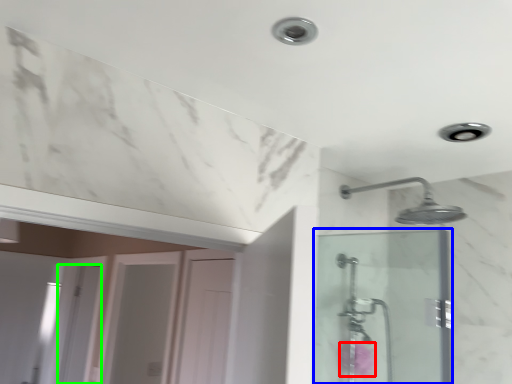
Question: Which object is positioned farthest from flower (highlighted by a red box)? Select from screen door (highlighted by a blue box) and screen door (highlighted by a green box).

Choices:
 (A) screen door
 (B) screen door

Answer: (B)